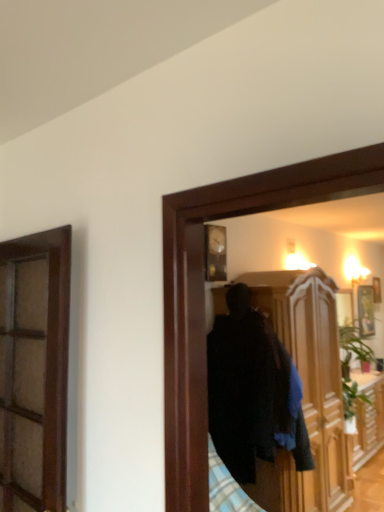
Question: Can you confirm if gold metallic picture frame at upper right is thinner than wooden cabinet at center?

Choices:
 (A) yes
 (B) no

Answer: (A)

Question: Can you confirm if gold metallic picture frame at upper right is positioned to the right of wooden cabinet at center?

Choices:
 (A) no
 (B) yes

Answer: (B)

Question: Is gold metallic picture frame at upper right positioned with its back to wooden cabinet at center?

Choices:
 (A) no
 (B) yes

Answer: (A)

Question: Is the depth of gold metallic picture frame at upper right less than that of wooden cabinet at center?

Choices:
 (A) yes
 (B) no

Answer: (B)

Question: Is gold metallic picture frame at upper right far from wooden cabinet at center?

Choices:
 (A) no
 (B) yes

Answer: (A)

Question: Is gold metallic picture frame at upper right completely or partially outside of wooden cabinet at center?

Choices:
 (A) no
 (B) yes

Answer: (B)

Question: Does wooden cabinet at center come in front of gold metallic picture frame at upper right?

Choices:
 (A) no
 (B) yes

Answer: (B)

Question: Can you confirm if wooden cabinet at center is wider than gold metallic picture frame at upper right?

Choices:
 (A) no
 (B) yes

Answer: (B)

Question: Is wooden cabinet at center to the left of gold metallic picture frame at upper right from the viewer's perspective?

Choices:
 (A) no
 (B) yes

Answer: (B)

Question: Does wooden cabinet at center lie behind gold metallic picture frame at upper right?

Choices:
 (A) no
 (B) yes

Answer: (A)

Question: Is wooden cabinet at center oriented away from gold metallic picture frame at upper right?

Choices:
 (A) no
 (B) yes

Answer: (A)

Question: From the image's perspective, would you say wooden cabinet at center is shown under gold metallic picture frame at upper right?

Choices:
 (A) yes
 (B) no

Answer: (A)

Question: Does point (372, 311) appear closer or farther from the camera than point (246, 487)?

Choices:
 (A) closer
 (B) farther

Answer: (B)